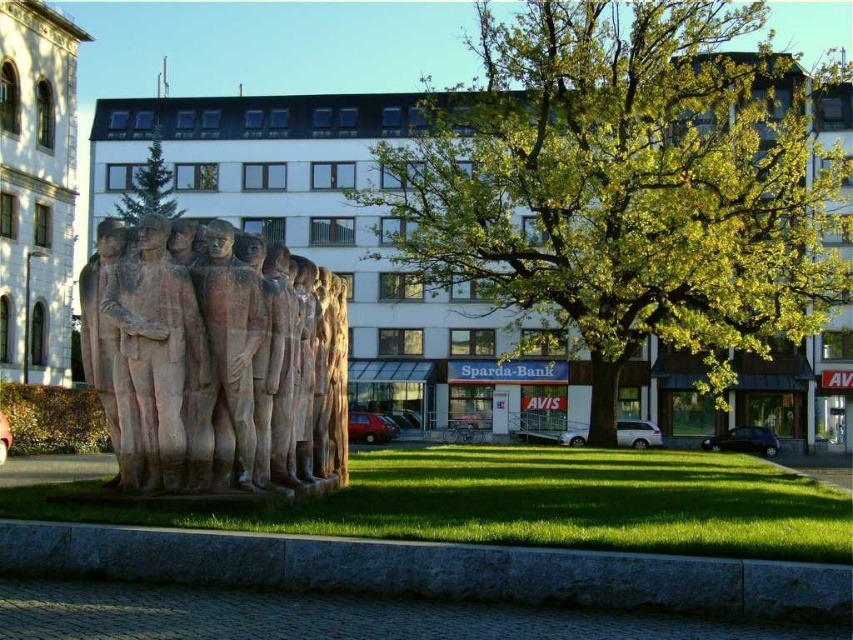
In the scene shown: You are a landscape architect planning to add a new bench in the public square. You want the bench to be placed between the green leafy tree at center and the rustic stone statues at center. Considering their sizes, which object should the bench be closer to to ensure there is enough space?

The green leafy tree at center is larger than the rustic stone statues at center. To ensure enough space, the bench should be placed closer to the rustic stone statues at center.

You are standing at the edge of the paved walkway in the foreground of the public square. You want to walk to the rustic stone sculpture at center. How many steps would you estimate it would take to reach it if each step is about 3 feet?

The distance between you and the rustic stone sculpture at center is 45.21 feet. Dividing this by 3 feet per step gives approximately 15 steps.